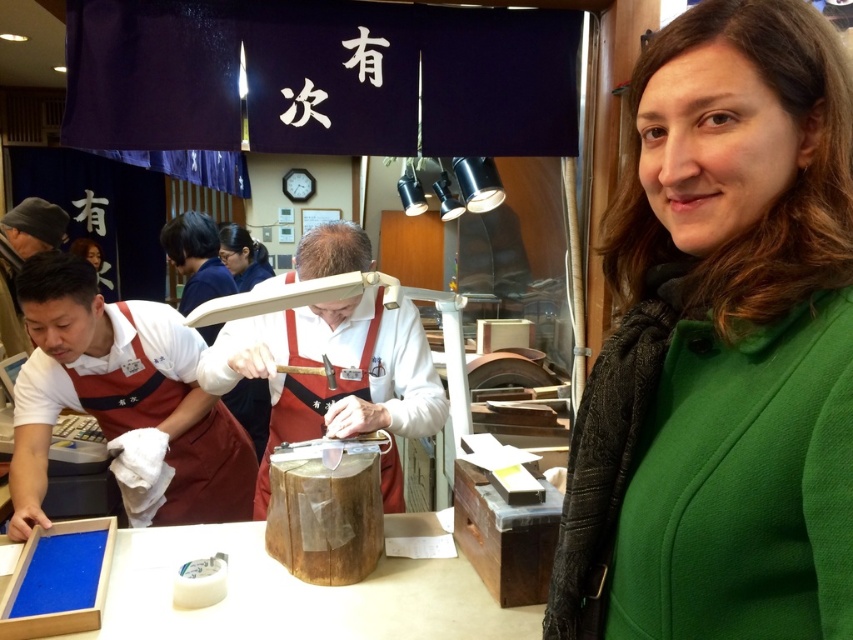
You are standing in the workshop and want to pick up an object located at point (234, 516) and another object at point (358, 248). Which point is closer to you?

Point (234, 516) is further to the camera than point (358, 248), so the point closer to you is point (358, 248).

You are an interior designer planning to place a 1.2 meter wide shelf between the green woolen coat at right and the white cotton apron at left. Based on their widths, will the shelf fit without overlapping either item?

The green woolen coat at right has a lesser width compared to white cotton apron at left. Since the shelf is 1.2 meters wide, it depends on the combined width of both items. If their total width is less than 1.2 meters, the shelf can fit. However, without specific measurements, we cannot confirm. Please check the total width of both items first.